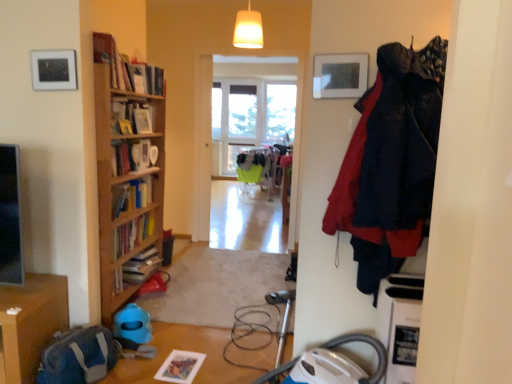
In order to face wooden bookcase at left, should I rotate leftwards or rightwards?

Rotate left and turn 17.889 degrees.

Measure the distance between white glossy bookshelf at upper left and camera.

They are 2.55 meters apart.

This screenshot has width=512, height=384. Describe the element at coordinates (391, 163) in the screenshot. I see `dark blue fabric coat at right` at that location.

Locate an element on the screen. The width and height of the screenshot is (512, 384). wooden table at lower left is located at coordinates (184, 350).

The width and height of the screenshot is (512, 384). What do you see at coordinates (54, 70) in the screenshot?
I see `matte white picture frame at upper left` at bounding box center [54, 70].

Measure the distance between transparent glass window at center, positioned as the first window in right-to-left order, and camera.

transparent glass window at center, positioned as the first window in right-to-left order, and camera are 4.66 meters apart.

Identify the location of wooden bookcase at left. click(x=127, y=169).

How different are the orientations of white glossy bookshelf at upper left and clear glass window at center, the 1th window from the left, in degrees?

The facing directions of white glossy bookshelf at upper left and clear glass window at center, the 1th window from the left, are 87.2 degrees apart.

Does point (132, 162) appear closer or farther from the camera than point (281, 81)?

Point (132, 162) is closer to the camera than point (281, 81).

Identify the location of the 2nd window behind when counting from the white glossy bookshelf at upper left. Image resolution: width=512 pixels, height=384 pixels. (249, 118).

From the image's perspective, which object appears higher, white glossy bookshelf at upper left or clear glass window at center, which ranks as the 2th window in right-to-left order?

clear glass window at center, which ranks as the 2th window in right-to-left order, from the image's perspective.

Which object is thinner, wooden bookcase at left or matte white picture frame at upper left?

Thinner between the two is matte white picture frame at upper left.

How different are the orientations of wooden bookcase at left and matte white picture frame at upper left in degrees?

The angular difference between wooden bookcase at left and matte white picture frame at upper left is 89.5 degrees.

Which point is more distant from viewer, (106, 46) or (74, 87)?

The point (106, 46) is farther.

Which object is closer to the camera, wooden bookcase at left or matte white picture frame at upper left?

matte white picture frame at upper left is closer to the camera.

I want to click on clothing in front of the wooden bookcase at left, so click(x=391, y=163).

Which of these two, dark blue fabric coat at right or wooden bookcase at left, is thinner?

Thinner between the two is wooden bookcase at left.

Does dark blue fabric coat at right turn towards wooden bookcase at left?

No, dark blue fabric coat at right is not facing towards wooden bookcase at left.

Is wooden table at lower left located within dark blue fabric coat at right?

Definitely not — wooden table at lower left is not inside dark blue fabric coat at right.

Considering the relative sizes of dark blue fabric coat at right and wooden table at lower left in the image provided, is dark blue fabric coat at right wider than wooden table at lower left?

Yes, dark blue fabric coat at right is wider than wooden table at lower left.

From the image's perspective, is dark blue fabric coat at right below wooden table at lower left?

Incorrect, from the image's perspective, dark blue fabric coat at right is higher than wooden table at lower left.

Would you consider dark blue fabric coat at right to be distant from wooden table at lower left?

Indeed, dark blue fabric coat at right is not near wooden table at lower left.

Which is more to the right, transparent glass window at center, the 2th window positioned from the left, or white glossy bookshelf at upper left?

transparent glass window at center, the 2th window positioned from the left.

From the image's perspective, count 2nd windows upward from the white glossy bookshelf at upper left and point to it. Please provide its 2D coordinates.

[(280, 112)]

Is transparent glass window at center, positioned as the first window in right-to-left order, aimed at white glossy bookshelf at upper left?

Yes, transparent glass window at center, positioned as the first window in right-to-left order, is facing white glossy bookshelf at upper left.

Would you say white glossy bookshelf at upper left is part of transparent glass window at center, positioned as the first window in right-to-left order,'s contents?

That's incorrect, white glossy bookshelf at upper left is not inside transparent glass window at center, positioned as the first window in right-to-left order.

From a real-world perspective, which is physically below, white glossy bookshelf at upper left or matte white picture frame at upper left?

white glossy bookshelf at upper left.

From the image's perspective, is white glossy bookshelf at upper left below matte white picture frame at upper left?

Yes.

Considering the relative sizes of white glossy bookshelf at upper left and matte white picture frame at upper left in the image provided, is white glossy bookshelf at upper left bigger than matte white picture frame at upper left?

Yes, white glossy bookshelf at upper left is bigger than matte white picture frame at upper left.

In order to click on book below the matte white picture frame at upper left (from a real-world perspective) in this screenshot , I will do coord(133,156).

In terms of height, does wooden bookcase at left look taller or shorter compared to transparent glass window at center, positioned as the first window in right-to-left order?

Clearly, wooden bookcase at left is taller compared to transparent glass window at center, positioned as the first window in right-to-left order.

From a real-world perspective, starting from the wooden bookcase at left, which window is the 2nd one vertically above it? Please provide its 2D coordinates.

[(280, 112)]

What's the angular difference between wooden bookcase at left and transparent glass window at center, the 2th window positioned from the left,'s facing directions?

wooden bookcase at left and transparent glass window at center, the 2th window positioned from the left, are facing 89 degrees away from each other.

Find the location of a particular element. The image size is (512, 384). book that appears below the clear glass window at center, which ranks as the 2th window in right-to-left order (from the image's perspective) is located at coordinates (133, 156).

The height and width of the screenshot is (384, 512). In the image, there is a matte white picture frame at upper left. Identify the location of bookcase below it (from a real-world perspective). (127, 169).

Looking at the image, which one is located closer to wooden bookcase at left, wooden table at lower left or matte white picture frame at upper left?

Among the two, matte white picture frame at upper left is located nearer to wooden bookcase at left.

From the image, which object appears to be farther from dark blue fabric coat at right, wooden bookcase at left or matte white picture frame at upper left?

Based on the image, matte white picture frame at upper left appears to be further to dark blue fabric coat at right.

Looking at the image, which one is located further to transparent glass window at center, positioned as the first window in right-to-left order, dark blue fabric coat at right or white glossy bookshelf at upper left?

dark blue fabric coat at right is further to transparent glass window at center, positioned as the first window in right-to-left order.

When comparing their distances from wooden bookcase at left, does wooden table at lower left or dark blue fabric coat at right seem further?

Based on the image, dark blue fabric coat at right appears to be further to wooden bookcase at left.

Considering their positions, is wooden bookcase at left positioned closer to wooden table at lower left than clear glass window at center, the 1th window from the left?

wooden bookcase at left is positioned closer to the anchor wooden table at lower left.

Estimate the real-world distances between objects in this image. Which object is further from wooden table at lower left, wooden bookcase at left or matte white picture frame at upper left?

Based on the image, matte white picture frame at upper left appears to be further to wooden table at lower left.

Considering their positions, is transparent glass window at center, positioned as the first window in right-to-left order, positioned closer to wooden table at lower left than clear glass window at center, which ranks as the 2th window in right-to-left order?

transparent glass window at center, positioned as the first window in right-to-left order, lies closer to wooden table at lower left than the other object.

Which object lies nearer to the anchor point wooden bookcase at left, transparent glass window at center, the 2th window positioned from the left, or clear glass window at center, which ranks as the 2th window in right-to-left order?

transparent glass window at center, the 2th window positioned from the left.

Find the location of a particular element. The width and height of the screenshot is (512, 384). bookcase positioned between dark blue fabric coat at right and clear glass window at center, which ranks as the 2th window in right-to-left order, from near to far is located at coordinates (127, 169).

Image resolution: width=512 pixels, height=384 pixels. What are the coordinates of `book positioned between wooden bookcase at left and clear glass window at center, which ranks as the 2th window in right-to-left order, from near to far` in the screenshot? It's located at (133, 156).

Where is `table between wooden bookcase at left and dark blue fabric coat at right`? Image resolution: width=512 pixels, height=384 pixels. table between wooden bookcase at left and dark blue fabric coat at right is located at coordinates (184, 350).

Identify the location of table situated between matte white picture frame at upper left and dark blue fabric coat at right from left to right. (184, 350).